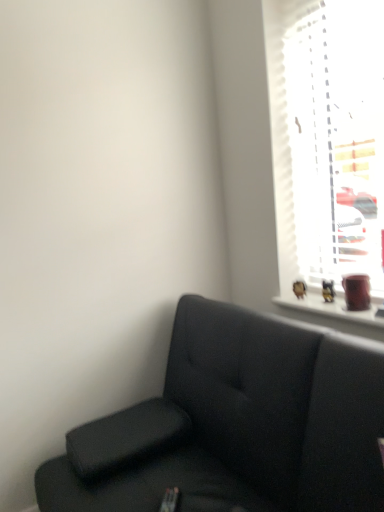
Question: Does white textured blinds at upper right have a greater height compared to suede black couch at lower right?

Choices:
 (A) no
 (B) yes

Answer: (B)

Question: Does white textured blinds at upper right have a lesser width compared to suede black couch at lower right?

Choices:
 (A) no
 (B) yes

Answer: (B)

Question: From the image's perspective, is white textured blinds at upper right on suede black couch at lower right?

Choices:
 (A) yes
 (B) no

Answer: (A)

Question: Is suede black couch at lower right inside white textured blinds at upper right?

Choices:
 (A) no
 (B) yes

Answer: (A)

Question: Is white textured blinds at upper right wider than suede black couch at lower right?

Choices:
 (A) no
 (B) yes

Answer: (A)

Question: From a real-world perspective, is white textured blinds at upper right beneath suede black couch at lower right?

Choices:
 (A) no
 (B) yes

Answer: (A)

Question: Is suede black couch at lower right closer to the viewer compared to white textured blinds at upper right?

Choices:
 (A) yes
 (B) no

Answer: (A)

Question: From a real-world perspective, is suede black couch at lower right on top of white textured blinds at upper right?

Choices:
 (A) yes
 (B) no

Answer: (B)

Question: Is white textured blinds at upper right a part of suede black couch at lower right?

Choices:
 (A) yes
 (B) no

Answer: (B)

Question: Does suede black couch at lower right have a lesser height compared to white textured blinds at upper right?

Choices:
 (A) yes
 (B) no

Answer: (A)

Question: Could you tell me if suede black couch at lower right is turned towards white textured blinds at upper right?

Choices:
 (A) no
 (B) yes

Answer: (A)

Question: Is suede black couch at lower right thinner than white textured blinds at upper right?

Choices:
 (A) yes
 (B) no

Answer: (B)

Question: In the image, is white textured blinds at upper right on the left side or the right side of suede black couch at lower right?

Choices:
 (A) right
 (B) left

Answer: (A)